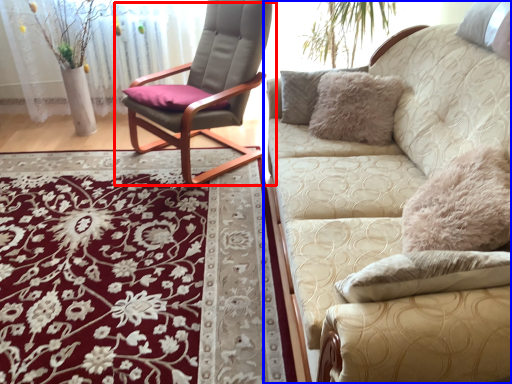
Question: Which of the following is the farthest to the observer, chair (highlighted by a red box) or studio couch (highlighted by a blue box)?

Choices:
 (A) chair
 (B) studio couch

Answer: (A)